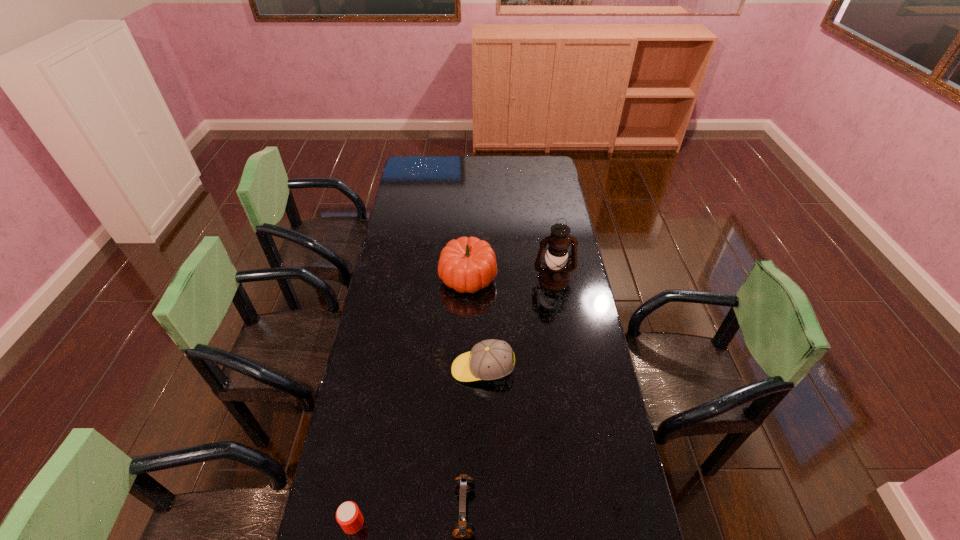
You are a GUI agent. You are given a task and a screenshot of the screen. Output one action in this format:
    pyautogui.click(x=<x>, y=<y>)
    Task: Click on the vacant space located 0.300m on the front-facing side of the baseball cap
    
    Given the screenshot: What is the action you would take?
    pyautogui.click(x=366, y=369)

This screenshot has height=540, width=960. Find the location of `free space located 0.050m on the back of the shortest object`. free space located 0.050m on the back of the shortest object is located at coordinates (359, 492).

In order to click on object located in the left edge section of the desktop in this screenshot , I will do `click(348, 515)`.

At what (x,y) coordinates should I click in order to perform the action: click on object that is at the right edge. Please return your answer as a coordinate pair (x, y). Image resolution: width=960 pixels, height=540 pixels. Looking at the image, I should click on (554, 275).

In the image, there is a desktop. At what (x,y) coordinates should I click in order to perform the action: click on blank space at the far edge. Please return your answer as a coordinate pair (x, y). Looking at the image, I should click on (465, 173).

At what (x,y) coordinates should I click in order to perform the action: click on free region at the left edge. Please return your answer as a coordinate pair (x, y). The image size is (960, 540). Looking at the image, I should click on (393, 374).

Find the location of a particular element. This screenshot has height=540, width=960. vacant space at the right edge of the desktop is located at coordinates coord(570,227).

Identify the location of vacant space at the far left corner of the desktop. The image size is (960, 540). (425, 158).

Where is `blank region between the second tallest object and the shortest object`? This screenshot has height=540, width=960. blank region between the second tallest object and the shortest object is located at coordinates (411, 400).

Find the location of a particular element. Image resolution: width=960 pixels, height=540 pixels. vacant space that's between the pumpkin and the baseball cap is located at coordinates (475, 323).